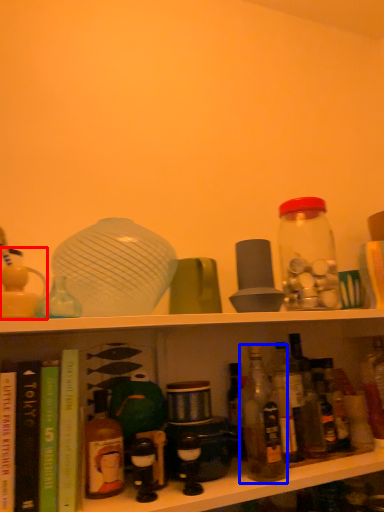
Question: Among these objects, which one is nearest to the camera, toy (highlighted by a red box) or bottle (highlighted by a blue box)?

Choices:
 (A) toy
 (B) bottle

Answer: (A)